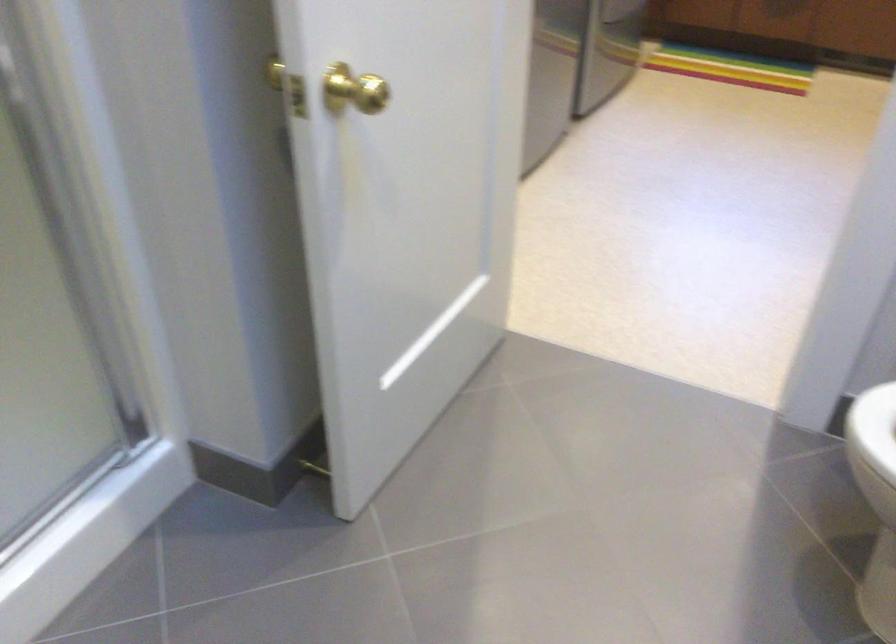
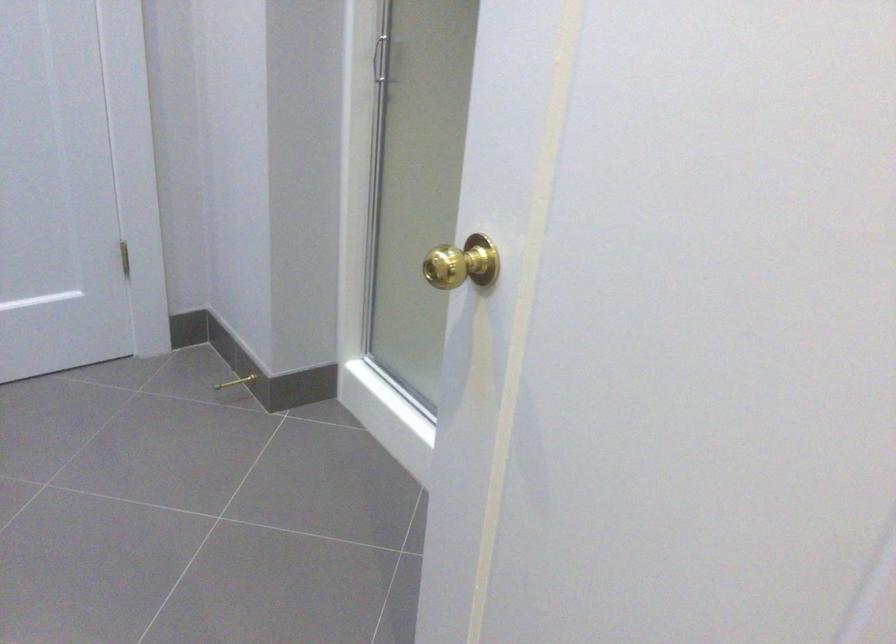
Locate, in the second image, the point that corresponds to the point at 366,73 in the first image.

(461, 263)